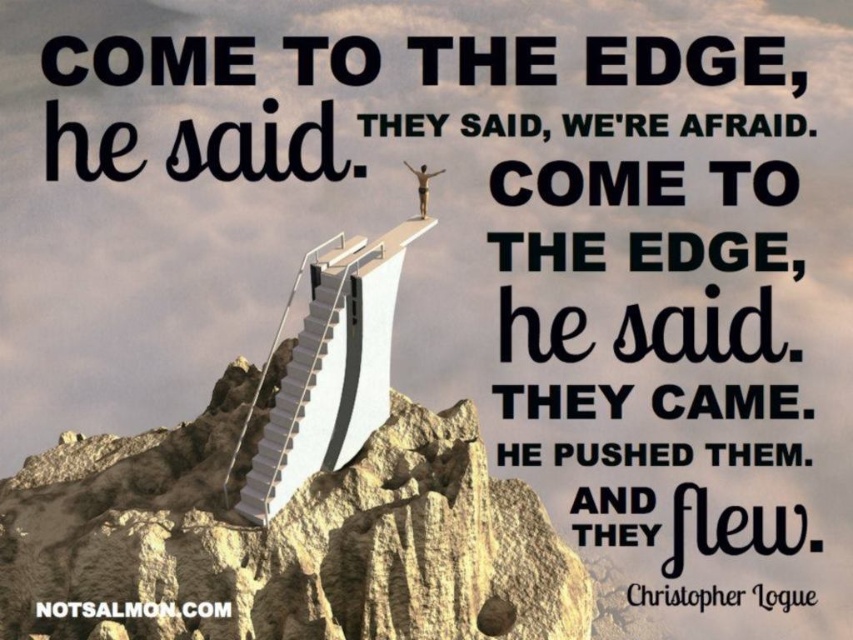
Question: Which of the following is the farthest from the observer?

Choices:
 (A) pyautogui.click(x=549, y=563)
 (B) pyautogui.click(x=265, y=520)

Answer: (A)

Question: Among these points, which one is farthest from the camera?

Choices:
 (A) (424, 200)
 (B) (144, 442)
 (C) (289, 416)

Answer: (B)

Question: Does rugged stone peak at center appear over white glossy stairs at center?

Choices:
 (A) yes
 (B) no

Answer: (B)

Question: Among these objects, which one is farthest from the camera?

Choices:
 (A) rugged stone peak at center
 (B) white glossy stairs at center
 (C) skinny human figure at upper center

Answer: (C)

Question: Does rugged stone peak at center have a greater width compared to skinny human figure at upper center?

Choices:
 (A) no
 (B) yes

Answer: (B)

Question: Does rugged stone peak at center have a lesser width compared to white glossy stairs at center?

Choices:
 (A) yes
 (B) no

Answer: (B)